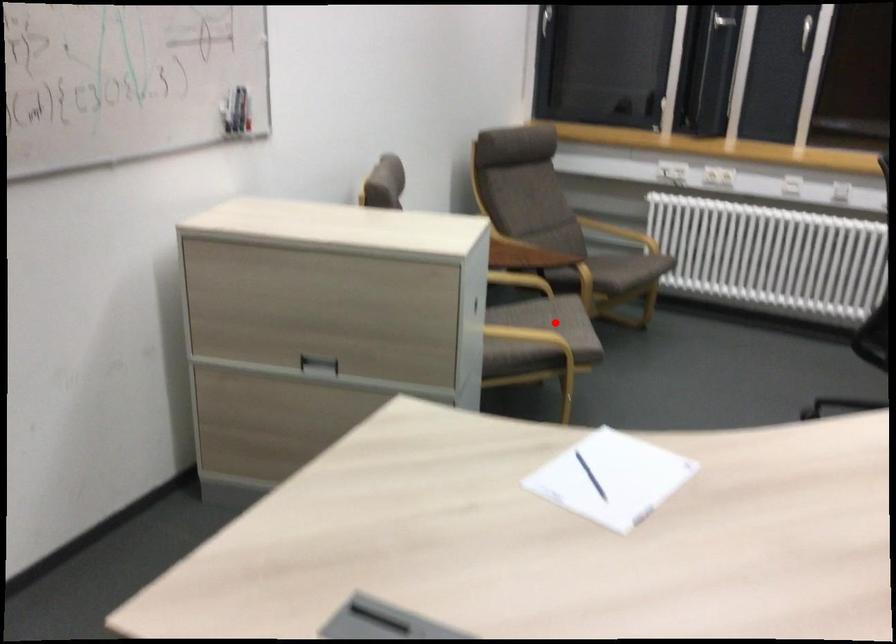
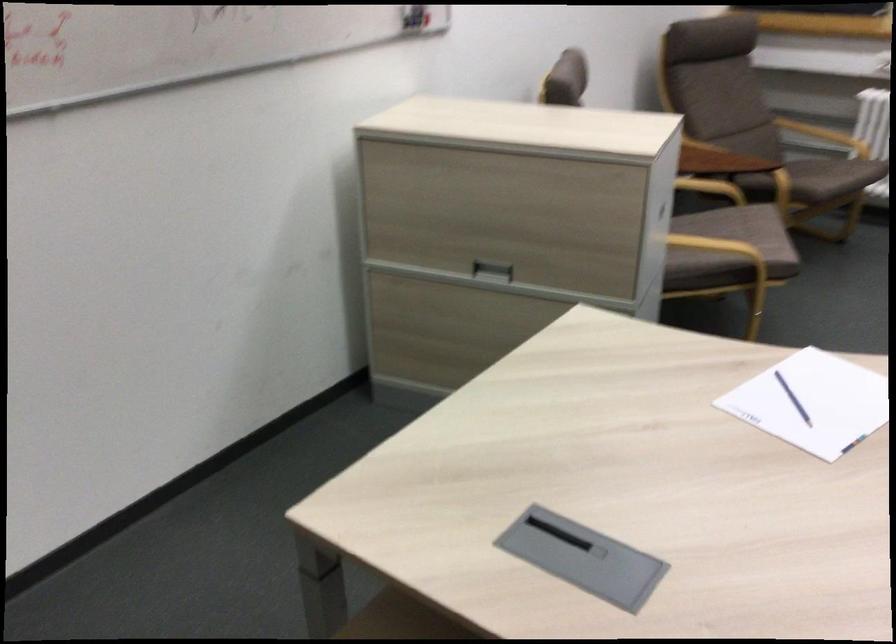
Where in the second image is the point corresponding to the highlighted location from the first image?

(746, 232)